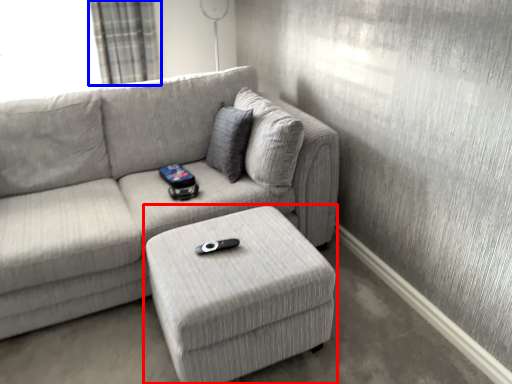
Question: Which of the following is the farthest to the observer, table (highlighted by a red box) or curtain (highlighted by a blue box)?

Choices:
 (A) table
 (B) curtain

Answer: (B)